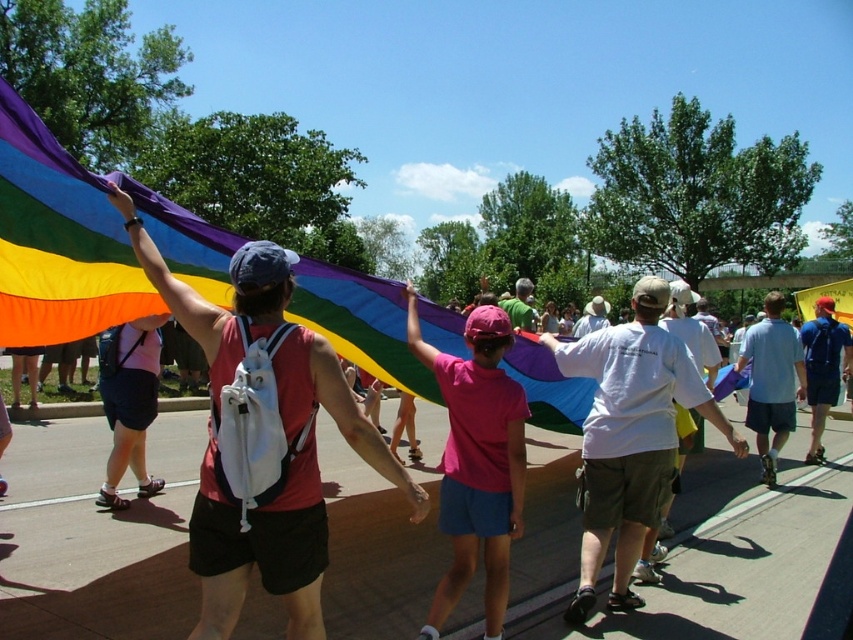
Is point (770, 426) less distant than point (821, 397)?

Yes, it is.

The image size is (853, 640). I want to click on light blue shirt at center, so coord(770,381).

Looking at this image, does rainbow fabric flag at upper left appear under light blue shirt at center?

No.

You are a GUI agent. You are given a task and a screenshot of the screen. Output one action in this format:
    pyautogui.click(x=<x>, y=<y>)
    Task: Click on the rainbow fabric flag at upper left
    
    Given the screenshot: What is the action you would take?
    pyautogui.click(x=84, y=241)

Which is in front, point (614, 461) or point (506, 564)?

Point (506, 564) is in front.

Is white cotton t-shirt at center wider than pink fabric shirt at center?

Indeed, white cotton t-shirt at center has a greater width compared to pink fabric shirt at center.

The image size is (853, 640). What do you see at coordinates (630, 435) in the screenshot?
I see `white cotton t-shirt at center` at bounding box center [630, 435].

You are a GUI agent. You are given a task and a screenshot of the screen. Output one action in this format:
    pyautogui.click(x=<x>, y=<y>)
    Task: Click on the white cotton t-shirt at center
    Image resolution: width=853 pixels, height=640 pixels.
    Given the screenshot: What is the action you would take?
    pyautogui.click(x=630, y=435)